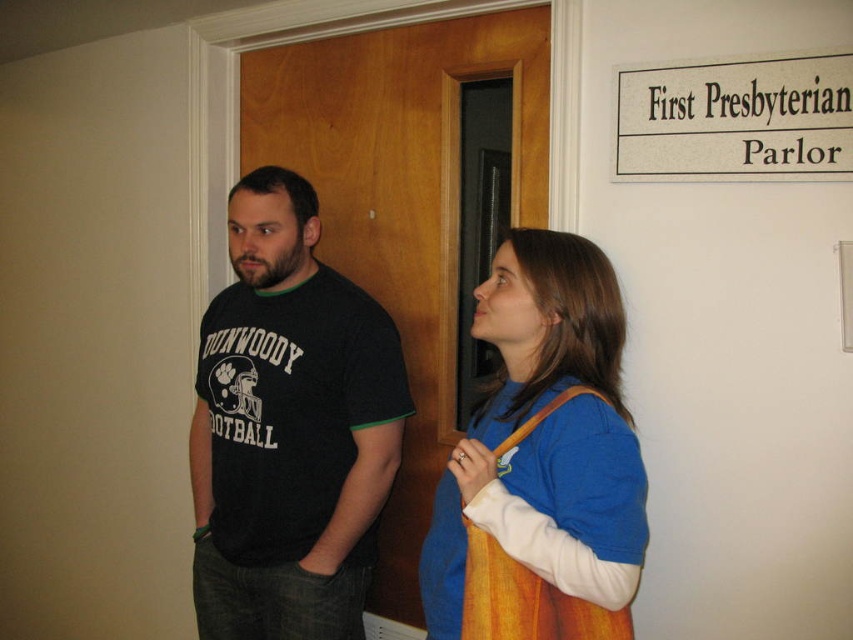
You are standing in the room and want to move from the point at coordinates point (396, 440) to the point at coordinates point (757, 92). Which direction should you move to get closer to your destination?

Since point (396, 440) is further to the camera than point (757, 92), you should move towards the direction of the camera to get closer to your destination.

You are an interior designer observing the scene. The client wants to know if the blue fabric shirt at center will be visible from the entrance when hanging the white paper sign at upper right. Based on their positions, can you confirm visibility?

The blue fabric shirt at center is below the white paper sign at upper right, so it will be visible from the entrance as it is positioned lower than the sign.